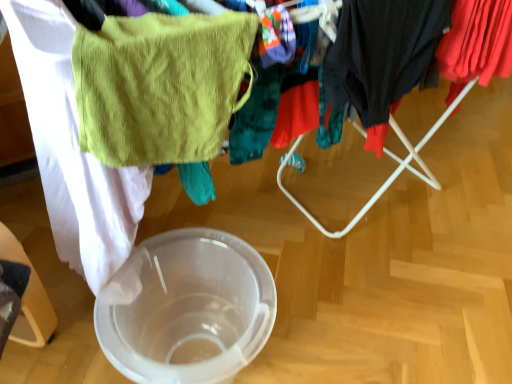
Question: Considering the positions of point (368, 61) and point (195, 248), is point (368, 61) closer or farther from the camera than point (195, 248)?

Choices:
 (A) farther
 (B) closer

Answer: (B)

Question: In the image, is dark gray fabric at right, the first clothing from the left, positioned in front of or behind transparent plastic bowl at center?

Choices:
 (A) front
 (B) behind

Answer: (B)

Question: Which object is the farthest from the green terry cloth towel at upper left?

Choices:
 (A) transparent plastic bowl at center
 (B) red cotton shirt at upper right, arranged as the 2th clothing when viewed from the left
 (C) dark gray fabric at right, the second clothing viewed from the right

Answer: (B)

Question: Estimate the real-world distances between objects in this image. Which object is farther from the dark gray fabric at right, the second clothing viewed from the right?

Choices:
 (A) transparent plastic bowl at center
 (B) red cotton shirt at upper right, arranged as the first clothing when viewed from the right
 (C) green terry cloth towel at upper left

Answer: (A)